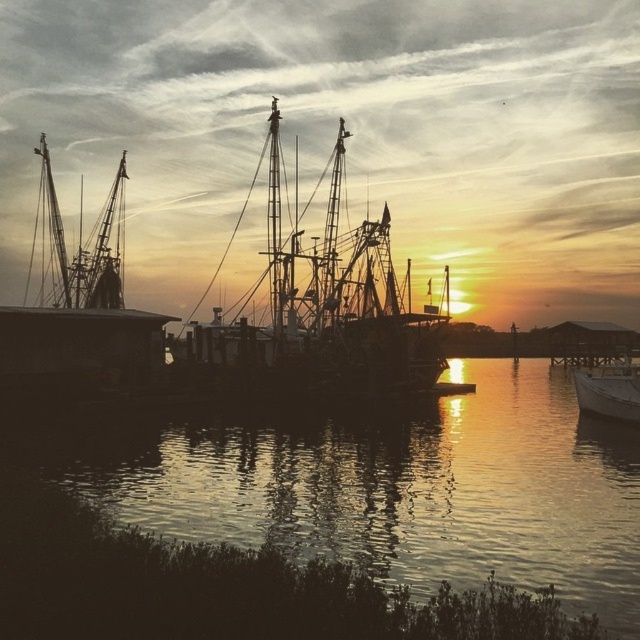
Between glistening water at center and silhouette wooden boat at center, which one is positioned higher?

silhouette wooden boat at center

Looking at this image, which of these two, glistening water at center or silhouette wooden boat at center, stands taller?

Standing taller between the two is silhouette wooden boat at center.

The image size is (640, 640). In order to click on glistening water at center in this screenshot , I will do `click(416, 490)`.

Who is shorter, silhouette wooden boat at center or white matte boat at lower right?

Standing shorter between the two is white matte boat at lower right.

Between silhouette wooden boat at center and white matte boat at lower right, which one is positioned lower?

white matte boat at lower right

Is point (365, 337) closer to viewer compared to point (632, 404)?

No.

Find the location of a particular element. This screenshot has height=640, width=640. silhouette wooden boat at center is located at coordinates (332, 307).

Who is positioned more to the right, glistening water at center or white matte boat at lower right?

white matte boat at lower right

Is point (570, 490) farther from viewer compared to point (624, 358)?

No, it is in front of (624, 358).

Is point (540, 448) positioned in front of point (632, 400)?

No.

Find the location of a particular element. This screenshot has height=640, width=640. glistening water at center is located at coordinates (416, 490).